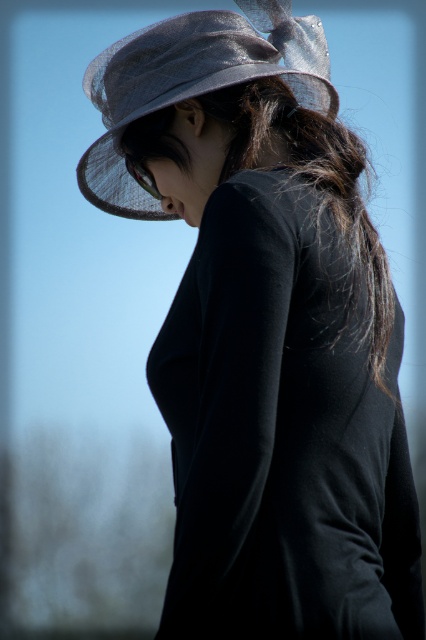
Based on the photo, does black silky hair at center have a greater height compared to satin-like gray hat at upper center?

Yes, black silky hair at center is taller than satin-like gray hat at upper center.

Between black silky hair at center and satin-like gray hat at upper center, which one is positioned lower?

black silky hair at center is lower down.

Where is `black silky hair at center`? This screenshot has width=426, height=640. black silky hair at center is located at coordinates (290, 179).